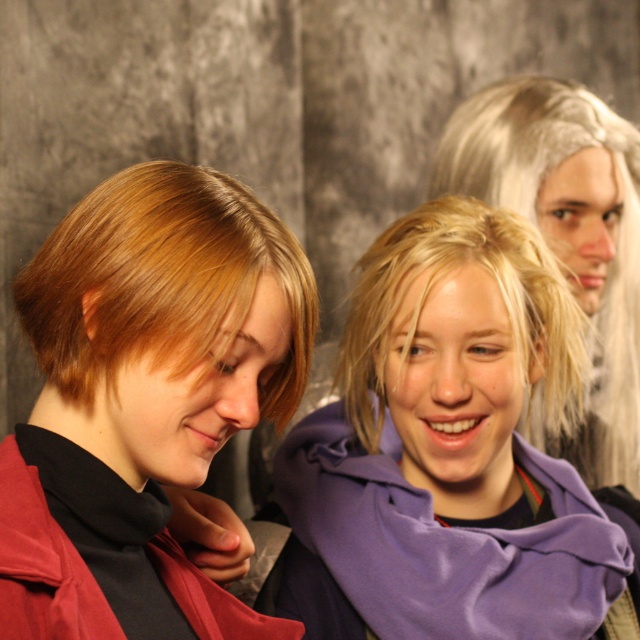
Is blonde hair at center taller than matte red jacket at lower left?

Indeed, blonde hair at center has a greater height compared to matte red jacket at lower left.

Is blonde hair at center to the right of matte red jacket at lower left from the viewer's perspective?

Correct, you'll find blonde hair at center to the right of matte red jacket at lower left.

Does point (369, 394) come farther from viewer compared to point (90, 580)?

That is True.

Where is `blonde hair at center`? Image resolution: width=640 pixels, height=640 pixels. blonde hair at center is located at coordinates (433, 285).

Is purple fleece scarf at center thinner than blonde hair at center?

Incorrect, purple fleece scarf at center's width is not less than blonde hair at center's.

Is point (380, 312) positioned after point (515, 266)?

Yes, it is behind point (515, 266).

Locate an element on the screen. The height and width of the screenshot is (640, 640). purple fleece scarf at center is located at coordinates (449, 449).

Is purple fleece scarf at center taller than blonde wig at upper right?

No, purple fleece scarf at center is not taller than blonde wig at upper right.

Looking at this image, is purple fleece scarf at center smaller than blonde wig at upper right?

Incorrect, purple fleece scarf at center is not smaller in size than blonde wig at upper right.

You are a GUI agent. You are given a task and a screenshot of the screen. Output one action in this format:
    pyautogui.click(x=<x>, y=<y>)
    Task: Click on the purple fleece scarf at center
    The width and height of the screenshot is (640, 640).
    Given the screenshot: What is the action you would take?
    pyautogui.click(x=449, y=449)